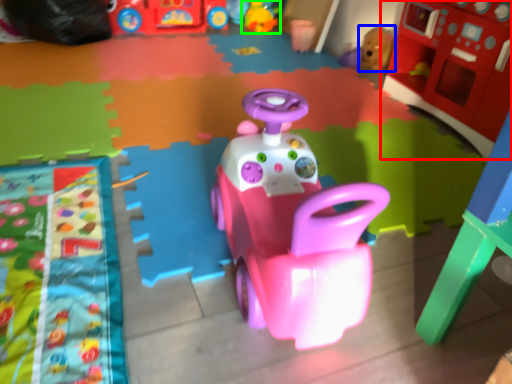
Question: Estimate the real-world distances between objects in this image. Which object is closer to toy (highlighted by a red box), toy (highlighted by a blue box) or toy (highlighted by a green box)?

Choices:
 (A) toy
 (B) toy

Answer: (A)